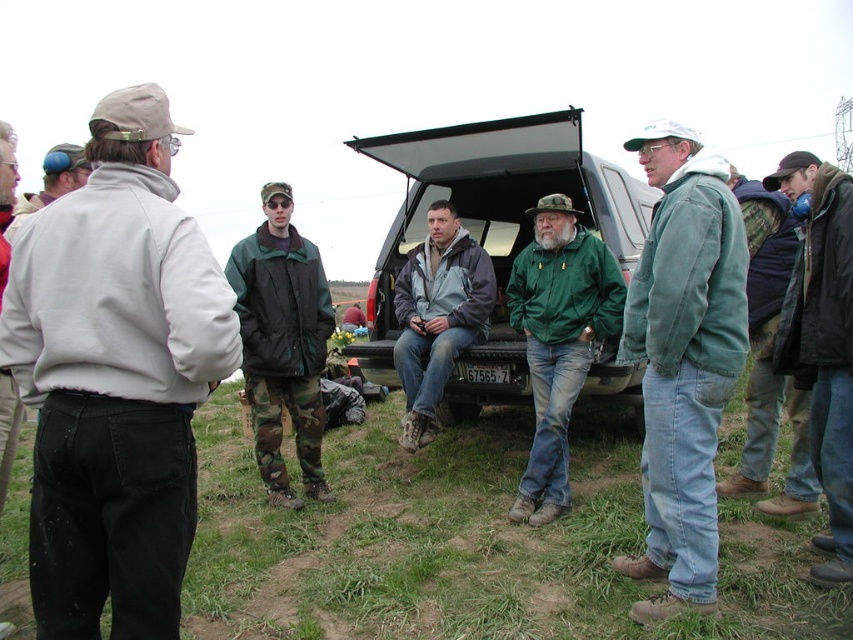
You are a photographer trying to capture a group photo of the green corduroy jacket at center and the matte black truck at center. Which object will appear taller in the photo?

The green corduroy jacket at center will appear taller in the photo because it has a greater height compared to the matte black truck at center.

You are a photographer trying to capture both the light gray fleece jacket at left and the matte black truck at center in a single frame. Which object should you focus on first to ensure both are in the frame?

You should focus on the matte black truck at center first because it is larger than the light gray fleece jacket at left, allowing you to frame it properly while ensuring the smaller jacket also fits into the shot.